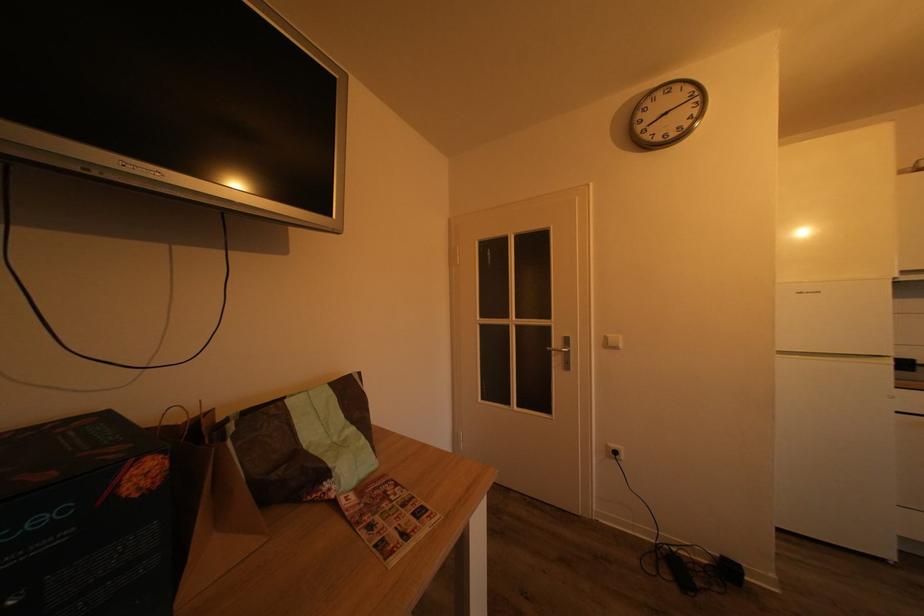
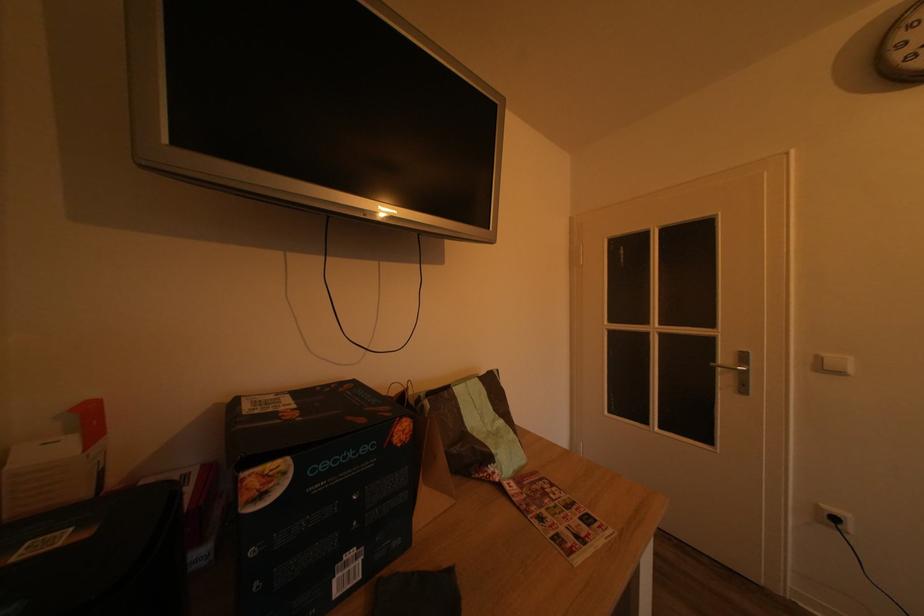
In the second image, find the point that corresponds to the point at 360,435 in the first image.

(508, 428)